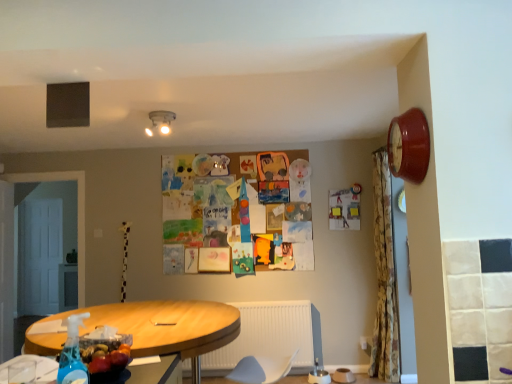
Question: From the image's perspective, is floral fabric shower curtain at right on blue translucent spray bottle at lower left?

Choices:
 (A) no
 (B) yes

Answer: (A)

Question: From the image's perspective, is floral fabric shower curtain at right beneath blue translucent spray bottle at lower left?

Choices:
 (A) no
 (B) yes

Answer: (B)

Question: Considering the relative sizes of floral fabric shower curtain at right and blue translucent spray bottle at lower left in the image provided, is floral fabric shower curtain at right shorter than blue translucent spray bottle at lower left?

Choices:
 (A) no
 (B) yes

Answer: (A)

Question: Can you confirm if floral fabric shower curtain at right is positioned to the left of blue translucent spray bottle at lower left?

Choices:
 (A) no
 (B) yes

Answer: (A)

Question: Does floral fabric shower curtain at right have a lesser width compared to blue translucent spray bottle at lower left?

Choices:
 (A) no
 (B) yes

Answer: (A)

Question: Is shiny plastic bottle of water at lower left inside or outside of matte white ceiling light at upper center?

Choices:
 (A) inside
 (B) outside

Answer: (B)

Question: From the image's perspective, relative to matte white ceiling light at upper center, is shiny plastic bottle of water at lower left above or below?

Choices:
 (A) above
 (B) below

Answer: (B)

Question: In terms of width, does shiny plastic bottle of water at lower left look wider or thinner when compared to matte white ceiling light at upper center?

Choices:
 (A) wide
 (B) thin

Answer: (A)

Question: Based on their sizes in the image, would you say shiny plastic bottle of water at lower left is bigger or smaller than matte white ceiling light at upper center?

Choices:
 (A) small
 (B) big

Answer: (B)

Question: Is floral fabric shower curtain at right taller or shorter than matte white ceiling light at upper center?

Choices:
 (A) short
 (B) tall

Answer: (B)

Question: Is floral fabric shower curtain at right to the left or to the right of matte white ceiling light at upper center in the image?

Choices:
 (A) right
 (B) left

Answer: (A)

Question: In the image, is floral fabric shower curtain at right positioned in front of or behind matte white ceiling light at upper center?

Choices:
 (A) behind
 (B) front

Answer: (A)

Question: Is floral fabric shower curtain at right wider or thinner than matte white ceiling light at upper center?

Choices:
 (A) wide
 (B) thin

Answer: (A)

Question: In terms of size, does floral fabric shower curtain at right appear bigger or smaller than shiny plastic bottle of water at lower left?

Choices:
 (A) small
 (B) big

Answer: (B)

Question: From a real-world perspective, is floral fabric shower curtain at right above or below shiny plastic bottle of water at lower left?

Choices:
 (A) below
 (B) above

Answer: (B)